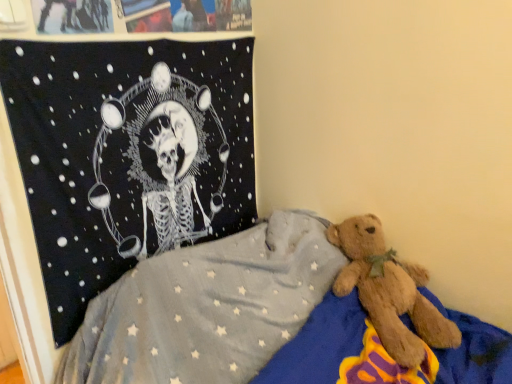
What do you see at coordinates (258, 320) in the screenshot?
I see `soft blue blanket with star pattern at center` at bounding box center [258, 320].

Locate an element on the screen. soft blue blanket with star pattern at center is located at coordinates tap(258, 320).

Measure the distance between point (x=113, y=327) and camera.

The distance of point (x=113, y=327) from camera is 3.55 feet.

What do you see at coordinates (127, 154) in the screenshot? I see `black fabric tapestry at upper left` at bounding box center [127, 154].

Measure the distance between black fabric tapestry at upper left and camera.

A distance of 33.79 inches exists between black fabric tapestry at upper left and camera.

The image size is (512, 384). What are the coordinates of `black fabric tapestry at upper left` in the screenshot? It's located at (127, 154).

The width and height of the screenshot is (512, 384). Identify the location of soft blue blanket with star pattern at center. (258, 320).

Is black fabric tapestry at upper left to the right of soft blue blanket with star pattern at center from the viewer's perspective?

No.

In the image, is black fabric tapestry at upper left positioned in front of or behind soft blue blanket with star pattern at center?

Visually, black fabric tapestry at upper left is located behind soft blue blanket with star pattern at center.

Does point (45, 64) appear closer or farther from the camera than point (98, 382)?

Point (45, 64).

From the picture: From the image's perspective, is black fabric tapestry at upper left on top of soft blue blanket with star pattern at center?

Indeed, from the image's perspective, black fabric tapestry at upper left is shown above soft blue blanket with star pattern at center.

From a real-world perspective, who is located higher, black fabric tapestry at upper left or soft blue blanket with star pattern at center?

In real-world perspective, black fabric tapestry at upper left is above.

Is black fabric tapestry at upper left wider or thinner than soft blue blanket with star pattern at center?

Clearly, black fabric tapestry at upper left has less width compared to soft blue blanket with star pattern at center.

From their relative heights in the image, would you say black fabric tapestry at upper left is taller or shorter than soft blue blanket with star pattern at center?

In the image, black fabric tapestry at upper left appears to be taller than soft blue blanket with star pattern at center.

Between black fabric tapestry at upper left and soft blue blanket with star pattern at center, which one has smaller size?

Smaller between the two is black fabric tapestry at upper left.

Is black fabric tapestry at upper left not within soft blue blanket with star pattern at center?

Yes, black fabric tapestry at upper left is not within soft blue blanket with star pattern at center.

Is black fabric tapestry at upper left far from soft blue blanket with star pattern at center?

No, black fabric tapestry at upper left is not far from soft blue blanket with star pattern at center.

Is black fabric tapestry at upper left positioned with its back to soft blue blanket with star pattern at center?

That's not correct — black fabric tapestry at upper left is not looking away from soft blue blanket with star pattern at center.

How much distance is there between black fabric tapestry at upper left and soft blue blanket with star pattern at center?

The distance of black fabric tapestry at upper left from soft blue blanket with star pattern at center is 14.96 inches.

You are a GUI agent. You are given a task and a screenshot of the screen. Output one action in this format:
    pyautogui.click(x=<x>, y=<y>)
    Task: Click on the bed that is below the black fabric tapestry at upper left (from the image's perspective)
    The image size is (512, 384).
    Given the screenshot: What is the action you would take?
    pyautogui.click(x=258, y=320)

From the picture: Can you confirm if soft blue blanket with star pattern at center is positioned to the right of black fabric tapestry at upper left?

Yes, soft blue blanket with star pattern at center is to the right of black fabric tapestry at upper left.

Does soft blue blanket with star pattern at center come behind black fabric tapestry at upper left?

No, the depth of soft blue blanket with star pattern at center is less than that of black fabric tapestry at upper left.

Which is behind, point (237, 317) or point (193, 69)?

The point (193, 69) is farther.

From the image's perspective, is soft blue blanket with star pattern at center on black fabric tapestry at upper left?

No, from the image's perspective, soft blue blanket with star pattern at center is not above black fabric tapestry at upper left.

From a real-world perspective, is soft blue blanket with star pattern at center physically located above or below black fabric tapestry at upper left?

soft blue blanket with star pattern at center is situated lower than black fabric tapestry at upper left in the real world.

In terms of width, does soft blue blanket with star pattern at center look wider or thinner when compared to black fabric tapestry at upper left?

Clearly, soft blue blanket with star pattern at center has more width compared to black fabric tapestry at upper left.

From their relative heights in the image, would you say soft blue blanket with star pattern at center is taller or shorter than black fabric tapestry at upper left?

Clearly, soft blue blanket with star pattern at center is shorter compared to black fabric tapestry at upper left.

Which of these two, soft blue blanket with star pattern at center or black fabric tapestry at upper left, is smaller?

black fabric tapestry at upper left is smaller.

Would you say soft blue blanket with star pattern at center is inside or outside black fabric tapestry at upper left?

soft blue blanket with star pattern at center cannot be found inside black fabric tapestry at upper left.

Is soft blue blanket with star pattern at center not near black fabric tapestry at upper left?

Actually, soft blue blanket with star pattern at center and black fabric tapestry at upper left are a little close together.

Could you tell me if soft blue blanket with star pattern at center is facing black fabric tapestry at upper left?

No, soft blue blanket with star pattern at center is not facing towards black fabric tapestry at upper left.

Where is `pirate flag that is above the soft blue blanket with star pattern at center (from the image's perspective)`? This screenshot has height=384, width=512. pirate flag that is above the soft blue blanket with star pattern at center (from the image's perspective) is located at coordinates (127, 154).

At what (x,y) coordinates should I click in order to perform the action: click on pirate flag behind the soft blue blanket with star pattern at center. Please return your answer as a coordinate pair (x, y). Image resolution: width=512 pixels, height=384 pixels. Looking at the image, I should click on (127, 154).

You are a GUI agent. You are given a task and a screenshot of the screen. Output one action in this format:
    pyautogui.click(x=<x>, y=<y>)
    Task: Click on the bed lying below the black fabric tapestry at upper left (from the image's perspective)
    The height and width of the screenshot is (384, 512).
    Given the screenshot: What is the action you would take?
    pyautogui.click(x=258, y=320)